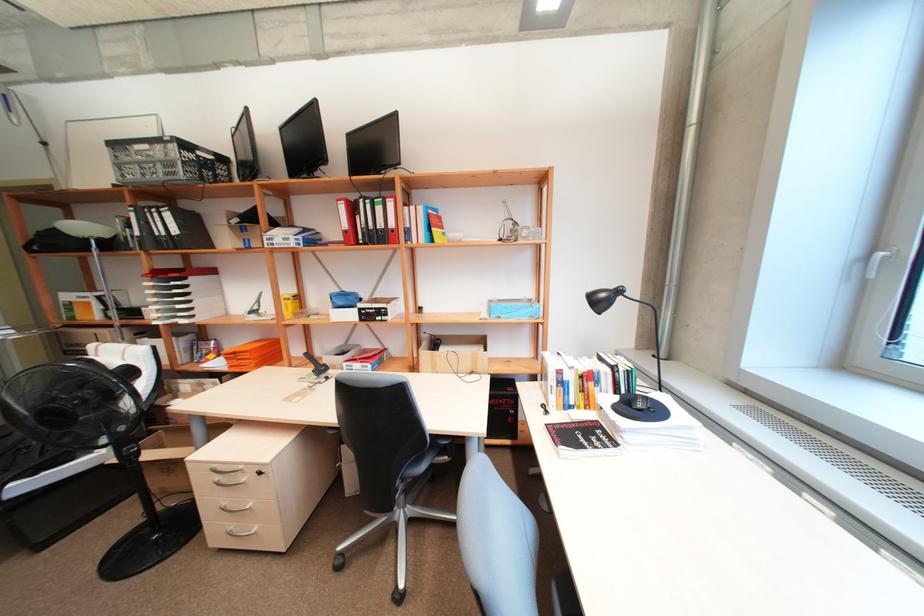
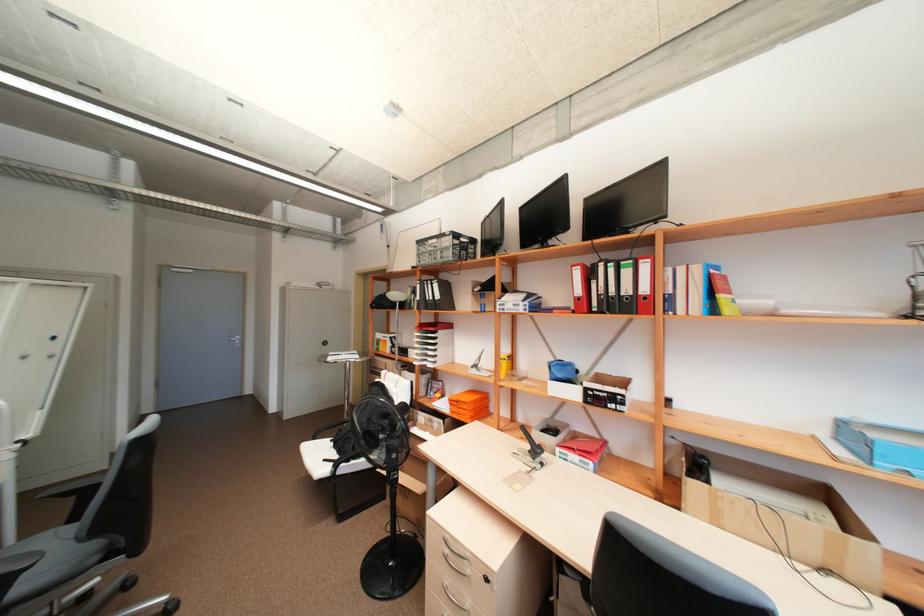
Find the pixel in the second image that matches point (239, 353) in the first image.

(463, 400)